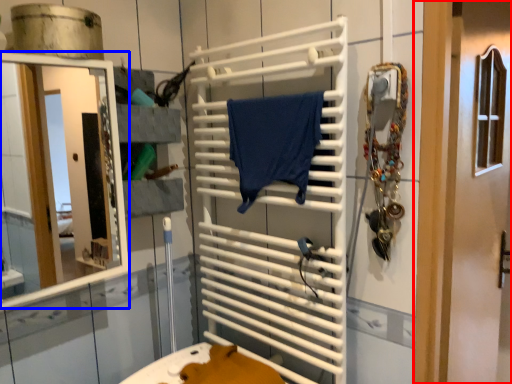
Question: Among these objects, which one is nearest to the camera, door (highlighted by a red box) or mirror (highlighted by a blue box)?

Choices:
 (A) door
 (B) mirror

Answer: (B)